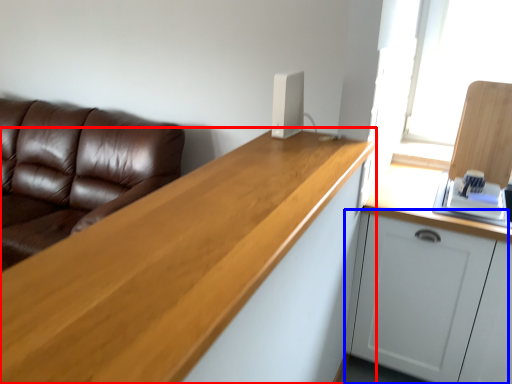
Question: Which object is closer to the camera taking this photo, countertop (highlighted by a red box) or cabinetry (highlighted by a blue box)?

Choices:
 (A) countertop
 (B) cabinetry

Answer: (A)